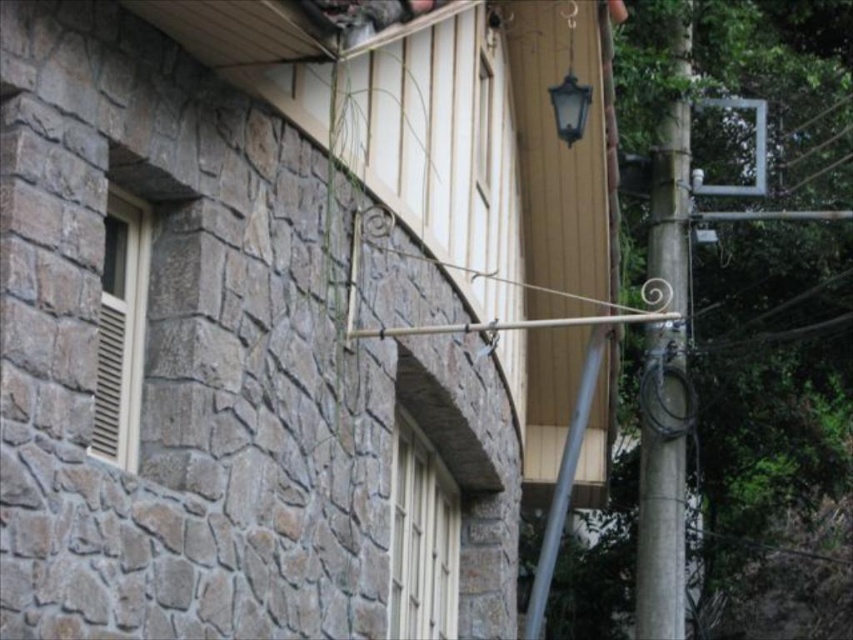
You are standing in front of the building and notice the smooth gray pole at right and the white textured window at center. Which object is positioned to the right of the other?

The smooth gray pole at right is to the right of the white textured window at center.